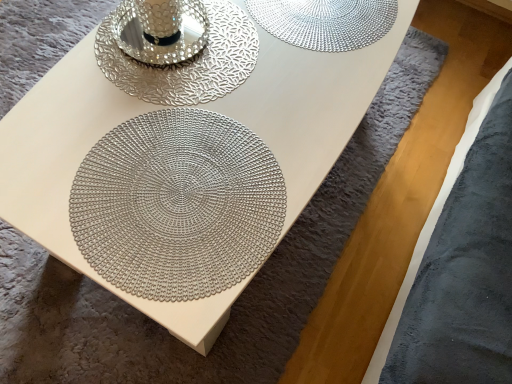
This screenshot has width=512, height=384. What are the coordinates of `vacant space to the left of metallic silver mandala at center` in the screenshot? It's located at (x=54, y=135).